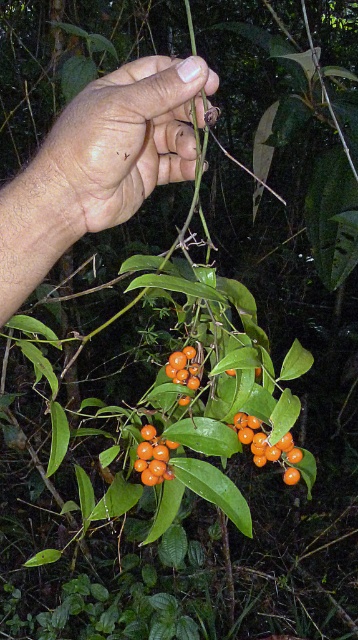
Question: Which is farther from the orange matte/soft berries at center?

Choices:
 (A) orange matte berries at center
 (B) dry skin at center
 (C) orange matte fruit at center

Answer: (B)

Question: Can you confirm if dry skin at center is thinner than orange matte/soft berries at center?

Choices:
 (A) yes
 (B) no

Answer: (B)

Question: Does dry skin at center have a lesser width compared to orange matte fruit at center?

Choices:
 (A) yes
 (B) no

Answer: (B)

Question: Considering the real-world distances, which object is closest to the orange matte fruit at center?

Choices:
 (A) orange matte berries at center
 (B) dry skin at center

Answer: (A)

Question: Which object is the farthest from the orange matte berries at center?

Choices:
 (A) dry skin at center
 (B) orange matte fruit at center

Answer: (A)

Question: Can you confirm if dry skin at center is bigger than orange matte/soft berries at center?

Choices:
 (A) no
 (B) yes

Answer: (B)